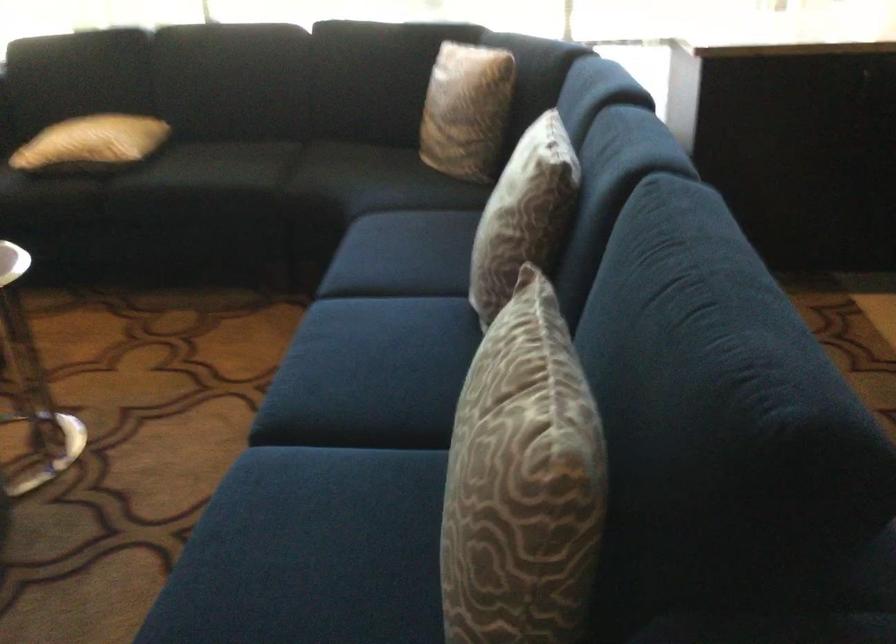
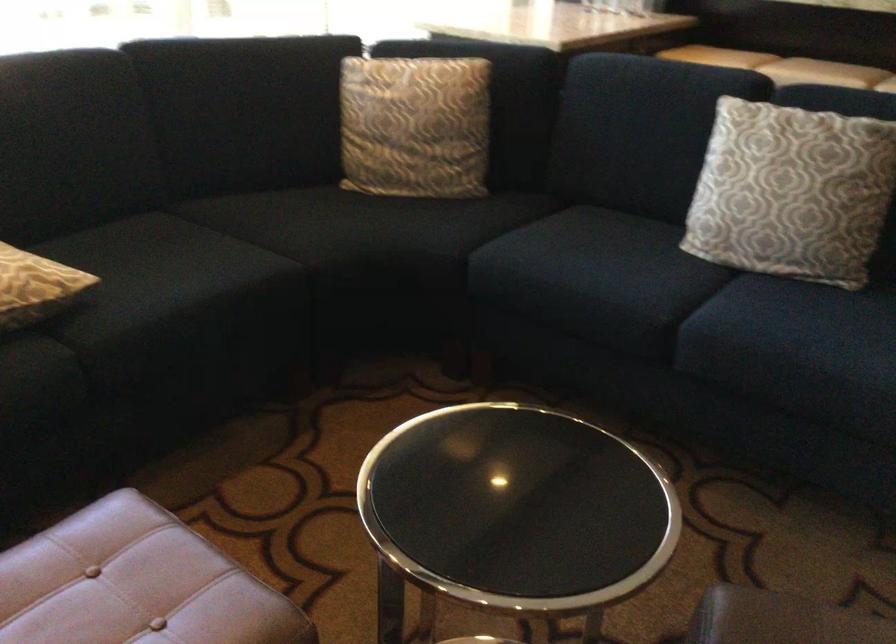
In the second image, find the point that corresponds to point 104,149 in the first image.

(35, 287)